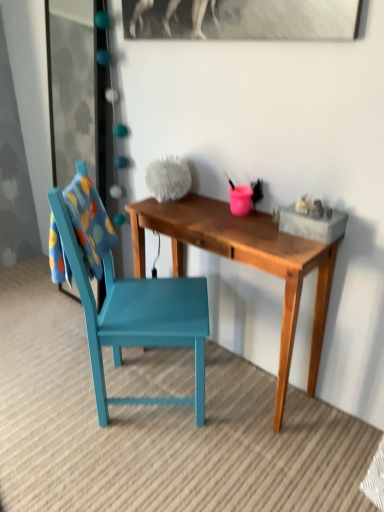
Where is `free space that is to the left of teal painted wood chair at left`? The width and height of the screenshot is (384, 512). free space that is to the left of teal painted wood chair at left is located at coordinates (49, 390).